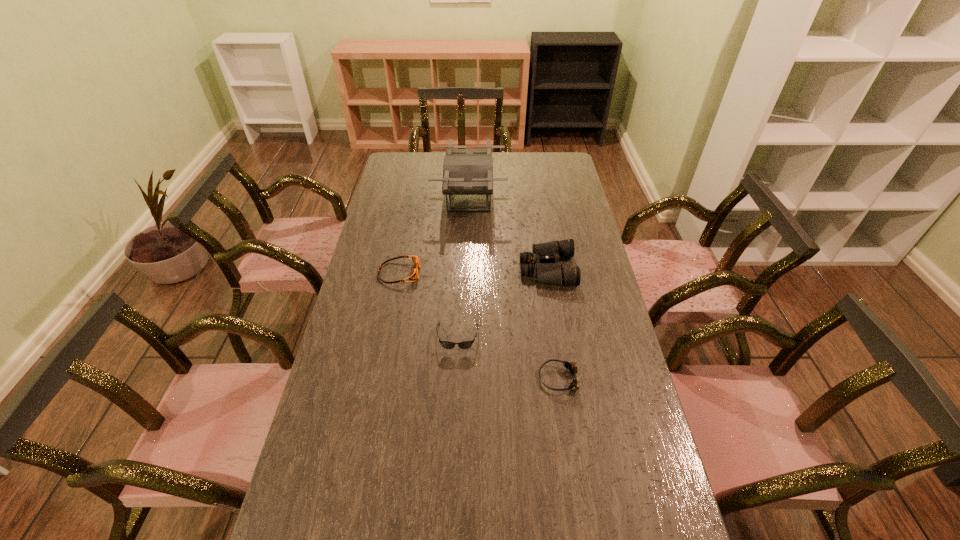
Where is `vacant region between the second nearest object and the right goggles`? The width and height of the screenshot is (960, 540). vacant region between the second nearest object and the right goggles is located at coordinates (509, 358).

Locate which object is the fourth closest to the leftmost object. Please provide its 2D coordinates. Your answer should be formatted as a tuple, i.e. [(x, y)], where the tuple contains the x and y coordinates of a point satisfying the conditions above.

[(570, 366)]

Select which object is the closest to the fourth shortest object. Please provide its 2D coordinates. Your answer should be formatted as a tuple, i.e. [(x, y)], where the tuple contains the x and y coordinates of a point satisfying the conditions above.

[(465, 171)]

In order to click on the second closest goggles to the drone in this screenshot , I will do `click(570, 366)`.

You are a GUI agent. You are given a task and a screenshot of the screen. Output one action in this format:
    pyautogui.click(x=<x>, y=<y>)
    Task: Click on the goggles that is the second closest to the fourth shortest object
    The height and width of the screenshot is (540, 960).
    Given the screenshot: What is the action you would take?
    pyautogui.click(x=414, y=274)